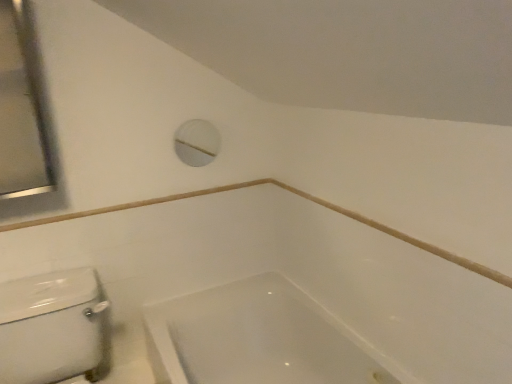
Question: Is white glossy bathtub at lower center inside or outside of satin silver mirror at upper left?

Choices:
 (A) inside
 (B) outside

Answer: (B)

Question: Is white glossy bathtub at lower center in front of or behind satin silver mirror at upper left in the image?

Choices:
 (A) front
 (B) behind

Answer: (A)

Question: Which object is the closest to the satin silver mirror at upper left?

Choices:
 (A) white glossy bathtub at lower center
 (B) white glossy porcelain at lower left
 (C) white plastic porthole at upper center

Answer: (B)

Question: Based on their relative distances, which object is nearer to the white glossy porcelain at lower left?

Choices:
 (A) white glossy bathtub at lower center
 (B) white plastic porthole at upper center
 (C) satin silver mirror at upper left

Answer: (A)